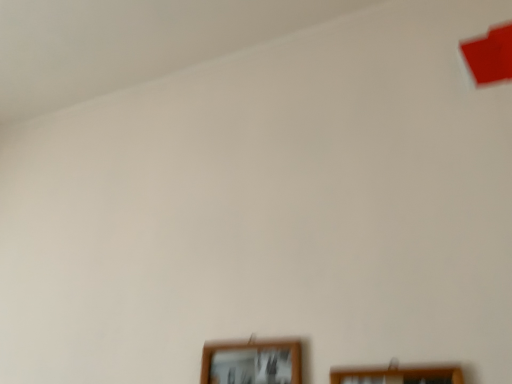
Question: In which direction should I rotate to look at wooden picture frame at lower center, marked as the 2th picture frame in a right-to-left arrangement?

Choices:
 (A) left
 (B) right

Answer: (A)

Question: Does wooden picture frame at lower center, which ranks as the 1th picture frame in left-to-right order, have a smaller size compared to wooden picture frame at lower right, which ranks as the 2th picture frame in left-to-right order?

Choices:
 (A) no
 (B) yes

Answer: (A)

Question: Is wooden picture frame at lower center, marked as the 2th picture frame in a right-to-left arrangement, at the left side of wooden picture frame at lower right, which ranks as the 2th picture frame in left-to-right order?

Choices:
 (A) yes
 (B) no

Answer: (A)

Question: Are wooden picture frame at lower center, marked as the 2th picture frame in a right-to-left arrangement, and wooden picture frame at lower right, the 1th picture frame viewed from the right, beside each other?

Choices:
 (A) yes
 (B) no

Answer: (B)

Question: Can we say wooden picture frame at lower center, marked as the 2th picture frame in a right-to-left arrangement, lies outside wooden picture frame at lower right, the 1th picture frame viewed from the right?

Choices:
 (A) no
 (B) yes

Answer: (B)

Question: Is wooden picture frame at lower center, marked as the 2th picture frame in a right-to-left arrangement, not close to wooden picture frame at lower right, the 1th picture frame viewed from the right?

Choices:
 (A) no
 (B) yes

Answer: (A)

Question: From a real-world perspective, is wooden picture frame at lower center, which ranks as the 1th picture frame in left-to-right order, physically above wooden picture frame at lower right, the 1th picture frame viewed from the right?

Choices:
 (A) no
 (B) yes

Answer: (B)

Question: Can you see wooden picture frame at lower right, the 1th picture frame viewed from the right, touching wooden picture frame at lower center, which ranks as the 1th picture frame in left-to-right order?

Choices:
 (A) yes
 (B) no

Answer: (B)

Question: Is the depth of wooden picture frame at lower right, the 1th picture frame viewed from the right, greater than that of wooden picture frame at lower center, which ranks as the 1th picture frame in left-to-right order?

Choices:
 (A) yes
 (B) no

Answer: (B)

Question: Does wooden picture frame at lower right, which ranks as the 2th picture frame in left-to-right order, have a lesser width compared to wooden picture frame at lower center, which ranks as the 1th picture frame in left-to-right order?

Choices:
 (A) no
 (B) yes

Answer: (B)

Question: Is wooden picture frame at lower center, marked as the 2th picture frame in a right-to-left arrangement, at the back of wooden picture frame at lower right, which ranks as the 2th picture frame in left-to-right order?

Choices:
 (A) yes
 (B) no

Answer: (B)

Question: Is wooden picture frame at lower center, marked as the 2th picture frame in a right-to-left arrangement, surrounded by wooden picture frame at lower right, the 1th picture frame viewed from the right?

Choices:
 (A) no
 (B) yes

Answer: (A)

Question: Considering the relative sizes of wooden picture frame at lower right, the 1th picture frame viewed from the right, and wooden picture frame at lower center, which ranks as the 1th picture frame in left-to-right order, in the image provided, is wooden picture frame at lower right, the 1th picture frame viewed from the right, smaller than wooden picture frame at lower center, which ranks as the 1th picture frame in left-to-right order,?

Choices:
 (A) yes
 (B) no

Answer: (A)

Question: From their relative heights in the image, would you say wooden picture frame at lower center, marked as the 2th picture frame in a right-to-left arrangement, is taller or shorter than wooden picture frame at lower right, which ranks as the 2th picture frame in left-to-right order?

Choices:
 (A) short
 (B) tall

Answer: (B)